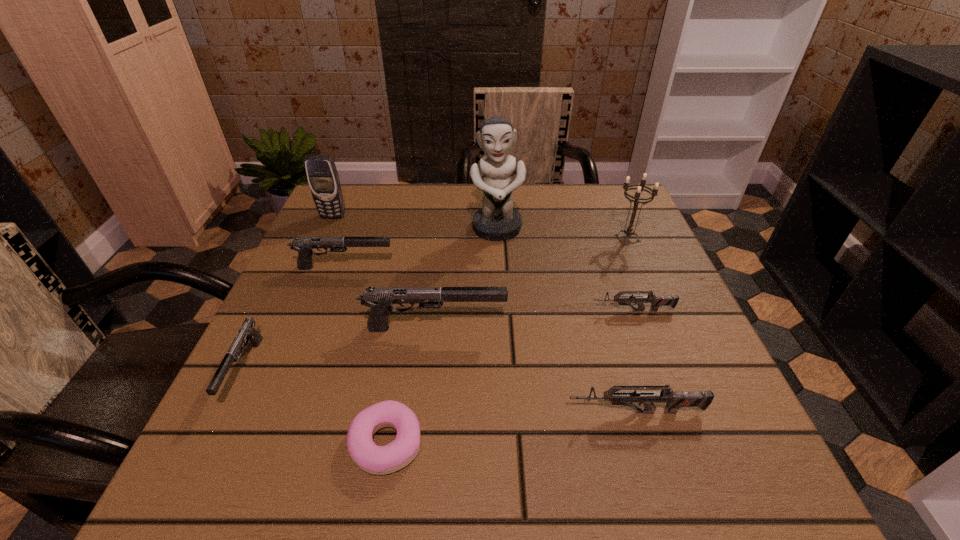
Locate an element on the screen. vacant area that lies between the pastry and the eighth tallest object is located at coordinates (510, 377).

You are a GUI agent. You are given a task and a screenshot of the screen. Output one action in this format:
    pyautogui.click(x=<x>, y=<y>)
    Task: Click on the vacant region between the shortest object and the cellular telephone
    The image size is (960, 540).
    Given the screenshot: What is the action you would take?
    pyautogui.click(x=360, y=330)

What are the coordinates of `free space that is in between the second tallest gun and the shortest object` in the screenshot? It's located at (365, 355).

Locate an element on the screen. free spot between the second farthest gun and the nearer grey gun is located at coordinates (635, 361).

The image size is (960, 540). Find the location of `empty location between the sixth farthest object and the nearest gray gun`. empty location between the sixth farthest object and the nearest gray gun is located at coordinates (339, 349).

Locate an element on the screen. Image resolution: width=960 pixels, height=540 pixels. free space between the fourth shortest gun and the pastry is located at coordinates (365, 355).

Find the location of a particular element. The image size is (960, 540). vacant area that lies between the pink pastry and the tallest gun is located at coordinates (410, 386).

I want to click on vacant area that lies between the candle holder and the shortest gun, so click(630, 274).

The height and width of the screenshot is (540, 960). I want to click on object that can be found as the seventh closest to the sixth farthest object, so click(x=629, y=230).

You are a GUI agent. You are given a task and a screenshot of the screen. Output one action in this format:
    pyautogui.click(x=<x>, y=<y>)
    Task: Click on the third closest object to the biggest gray gun
    
    Given the screenshot: What is the action you would take?
    pyautogui.click(x=656, y=301)